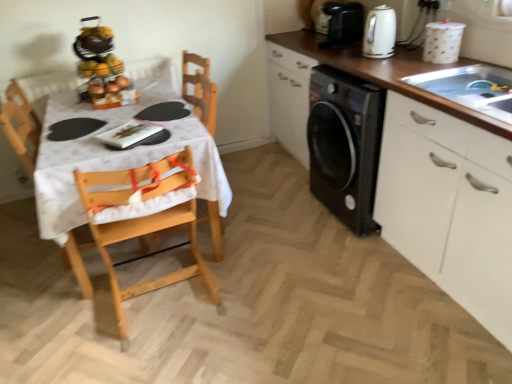
Question: Is white glossy cabinet at right positioned far away from white glossy kettle at upper right?

Choices:
 (A) no
 (B) yes

Answer: (A)

Question: From a real-world perspective, is white glossy cabinet at right positioned under white glossy kettle at upper right based on gravity?

Choices:
 (A) no
 (B) yes

Answer: (B)

Question: Is white glossy cabinet at right taller than white glossy kettle at upper right?

Choices:
 (A) yes
 (B) no

Answer: (A)

Question: Is white glossy cabinet at right not inside white glossy kettle at upper right?

Choices:
 (A) yes
 (B) no

Answer: (A)

Question: From the image's perspective, does white glossy cabinet at right appear lower than white glossy kettle at upper right?

Choices:
 (A) no
 (B) yes

Answer: (B)

Question: Looking at their shapes, would you say wooden highchair at left is wider or thinner than white glossy cabinet at right?

Choices:
 (A) wide
 (B) thin

Answer: (B)

Question: Is wooden highchair at left taller or shorter than white glossy cabinet at right?

Choices:
 (A) short
 (B) tall

Answer: (A)

Question: Based on their sizes in the image, would you say wooden highchair at left is bigger or smaller than white glossy cabinet at right?

Choices:
 (A) small
 (B) big

Answer: (A)

Question: Considering the relative positions of wooden highchair at left and white glossy cabinet at right in the image provided, is wooden highchair at left to the left or to the right of white glossy cabinet at right?

Choices:
 (A) left
 (B) right

Answer: (A)

Question: From the image's perspective, is white glossy canister at upper right, which ranks as the second appliance in back-to-front order, positioned above or below matte black coffee maker at upper right, the 2th appliance positioned from the right?

Choices:
 (A) above
 (B) below

Answer: (B)

Question: Considering the relative positions of white glossy canister at upper right, the 2th appliance viewed from the left, and matte black coffee maker at upper right, which ranks as the 1th appliance in back-to-front order, in the image provided, is white glossy canister at upper right, the 2th appliance viewed from the left, to the left or to the right of matte black coffee maker at upper right, which ranks as the 1th appliance in back-to-front order,?

Choices:
 (A) right
 (B) left

Answer: (A)

Question: Considering their positions, is white glossy canister at upper right, which ranks as the second appliance in back-to-front order, located in front of or behind matte black coffee maker at upper right, which is the second appliance in front-to-back order?

Choices:
 (A) behind
 (B) front

Answer: (B)

Question: Is white glossy canister at upper right, the 1th appliance from the bottom, wider or thinner than matte black coffee maker at upper right, the 2th appliance positioned from the right?

Choices:
 (A) wide
 (B) thin

Answer: (B)

Question: Is wooden highchair at left bigger or smaller than white glossy canister at upper right, the 1th appliance viewed from the front?

Choices:
 (A) small
 (B) big

Answer: (B)

Question: Relative to white glossy canister at upper right, which ranks as the second appliance in back-to-front order, is wooden highchair at left in front or behind?

Choices:
 (A) behind
 (B) front

Answer: (B)